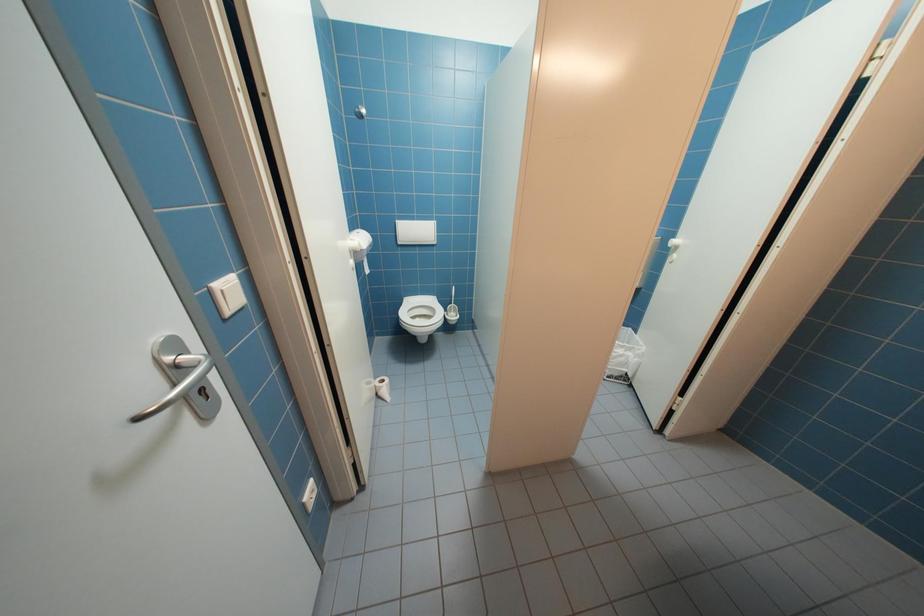
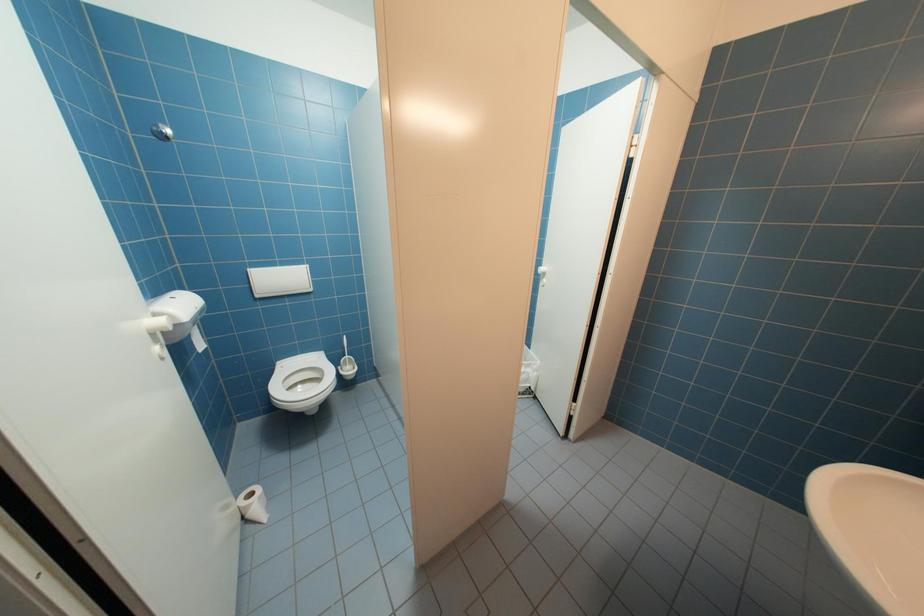
In a continuous first-person perspective shot, in which direction is the camera moving?

The movement direction of the cameraman is right, forward.